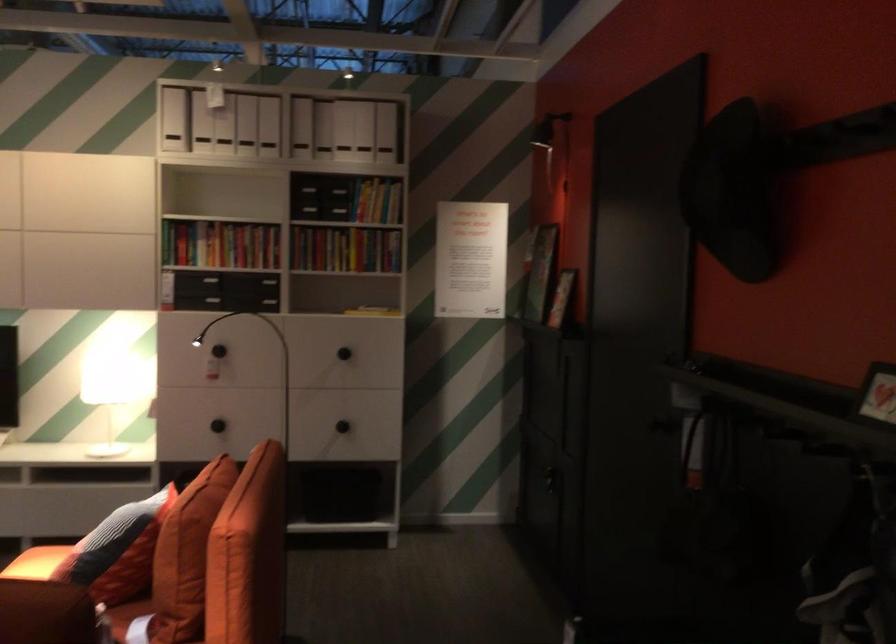
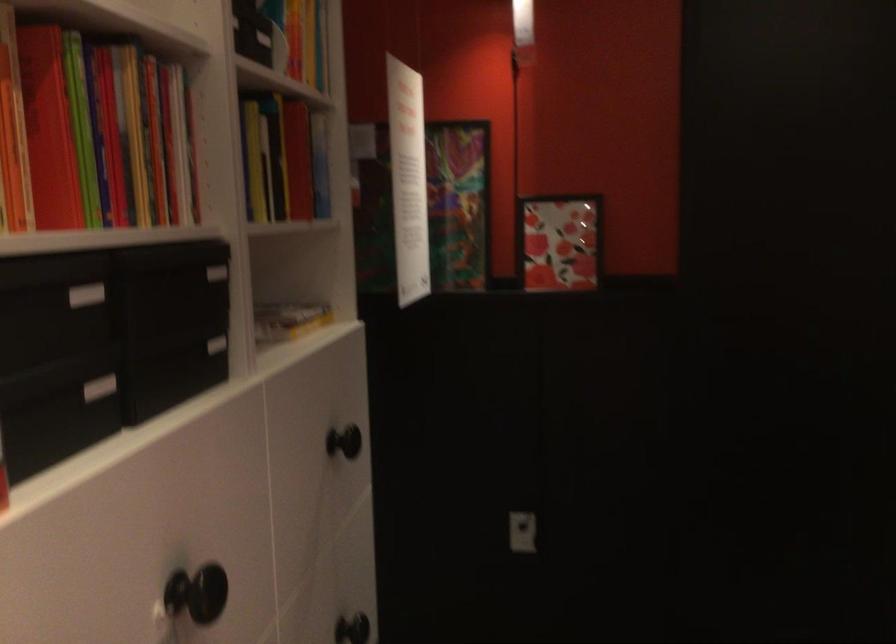
The point at (340,422) is marked in the first image. Where is the corresponding point in the second image?

(351, 629)